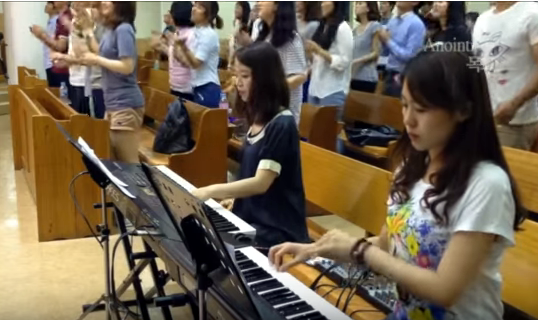
Identify the location of floor. The height and width of the screenshot is (320, 538). (35, 289).